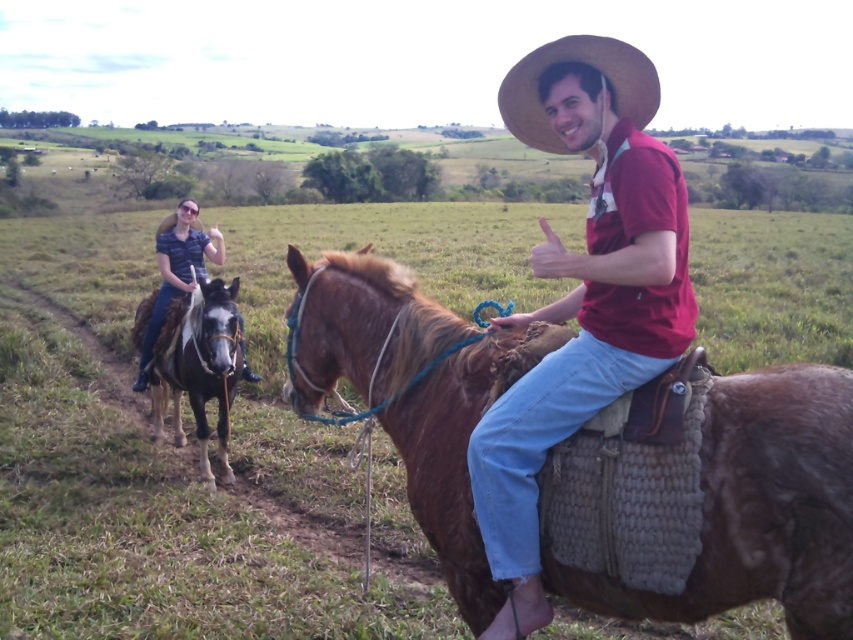
Does brown leather saddle at center appear under black glossy horse at left?

Actually, brown leather saddle at center is above black glossy horse at left.

Can you confirm if brown leather saddle at center is taller than black glossy horse at left?

Incorrect, brown leather saddle at center's height is not larger of black glossy horse at left's.

Based on the photo, who is more distant from viewer, (x=351, y=316) or (x=178, y=336)?

Point (x=178, y=336)

I want to click on brown leather saddle at center, so click(x=759, y=508).

Who is lower down, matte red shirt at center or straw hat at upper right?

matte red shirt at center

Does point (628, 51) lie behind point (558, 60)?

No, (628, 51) is closer to viewer.

Does point (473, 460) come closer to viewer compared to point (567, 54)?

Yes.

Find the location of `matte red shirt at center`. matte red shirt at center is located at coordinates (582, 291).

Between brown leather saddle at center and matte red shirt at center, which one has less height?

brown leather saddle at center

Is point (776, 529) more distant than point (509, 499)?

No.

What do you see at coordinates (759, 508) in the screenshot? I see `brown leather saddle at center` at bounding box center [759, 508].

Find the location of a particular element. This screenshot has height=640, width=853. brown leather saddle at center is located at coordinates (759, 508).